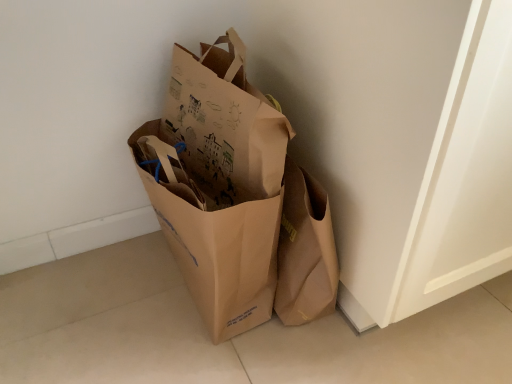
The height and width of the screenshot is (384, 512). What are the coordinates of `brown paper bags at lower left` in the screenshot? It's located at click(218, 184).

What do you see at coordinates (218, 184) in the screenshot?
I see `brown paper bags at lower left` at bounding box center [218, 184].

Identify the location of brown paper bags at lower left. (218, 184).